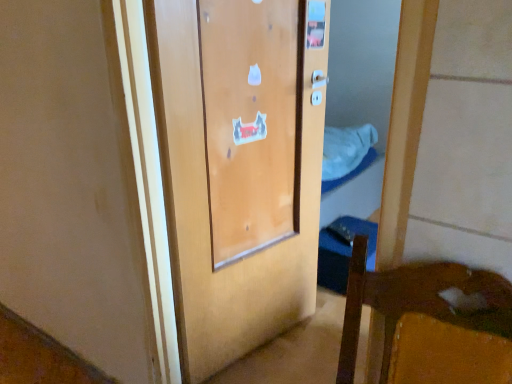
Where is `wooden door at center`? This screenshot has height=384, width=512. wooden door at center is located at coordinates (239, 166).

Describe the element at coordinates (239, 166) in the screenshot. The image size is (512, 384). I see `wooden door at center` at that location.

In order to face wooden door at center, should I rotate leftwards or rightwards?

Turn left approximately 0.008 degrees to face it.

Locate an element on the screen. This screenshot has height=384, width=512. white fabric at center is located at coordinates (345, 149).

The image size is (512, 384). What do you see at coordinates (345, 149) in the screenshot? I see `white fabric at center` at bounding box center [345, 149].

The height and width of the screenshot is (384, 512). I want to click on wooden door at center, so click(239, 166).

Considering the positions of objects white fabric at center and wooden door at center in the image provided, who is more to the right, white fabric at center or wooden door at center?

Positioned to the right is white fabric at center.

Which object is closer to the camera, white fabric at center or wooden door at center?

wooden door at center.

Which point is more distant from viewer, (339, 143) or (300, 53)?

The point (339, 143) is farther.

From the image's perspective, is white fabric at center under wooden door at center?

Incorrect, from the image's perspective, white fabric at center is higher than wooden door at center.

From the picture: From a real-world perspective, which object rests below the other?

white fabric at center.

Looking at their sizes, would you say white fabric at center is wider or thinner than wooden door at center?

white fabric at center is wider than wooden door at center.

Is white fabric at center taller than wooden door at center?

No, white fabric at center is not taller than wooden door at center.

Considering the sizes of white fabric at center and wooden door at center in the image, is white fabric at center bigger or smaller than wooden door at center?

In the image, white fabric at center appears to be smaller than wooden door at center.

Do you think white fabric at center is within wooden door at center, or outside of it?

white fabric at center is not inside wooden door at center, it's outside.

Are white fabric at center and wooden door at center beside each other?

No, white fabric at center is not next to wooden door at center.

Is white fabric at center facing away from wooden door at center?

No.

Locate an element on the screen. door in front of the white fabric at center is located at coordinates (239, 166).

Considering the positions of objects wooden door at center and white fabric at center in the image provided, who is more to the left, wooden door at center or white fabric at center?

wooden door at center is more to the left.

Considering their positions, is wooden door at center located in front of or behind white fabric at center?

wooden door at center is in front of white fabric at center.

In the scene shown: Which point is more forward, (243, 283) or (328, 147)?

Positioned in front is point (243, 283).

From the image's perspective, does wooden door at center appear higher than white fabric at center?

No.

From a real-world perspective, is wooden door at center above or below white fabric at center?

In terms of real-world spatial position, wooden door at center is above white fabric at center.

Looking at their sizes, would you say wooden door at center is wider or thinner than white fabric at center?

In the image, wooden door at center appears to be more narrow than white fabric at center.

Is wooden door at center shorter than white fabric at center?

No, wooden door at center is not shorter than white fabric at center.

Consider the image. Does wooden door at center have a larger size compared to white fabric at center?

Correct, wooden door at center is larger in size than white fabric at center.

Which is correct: wooden door at center is inside white fabric at center, or outside of it?

→ wooden door at center is not inside white fabric at center, it's outside.

Can you see wooden door at center touching white fabric at center?

No, wooden door at center is not making contact with white fabric at center.

Is wooden door at center turned away from white fabric at center?

No, wooden door at center is not facing away from white fabric at center.

What's the angular difference between wooden door at center and white fabric at center's facing directions?

wooden door at center and white fabric at center are facing 13 degrees away from each other.

Where is `door above the white fabric at center (from a real-world perspective)`? The width and height of the screenshot is (512, 384). door above the white fabric at center (from a real-world perspective) is located at coordinates (239, 166).

Identify the location of door located above the white fabric at center (from a real-world perspective). The height and width of the screenshot is (384, 512). (239, 166).

Identify the location of sheet located on the right of wooden door at center. (345, 149).